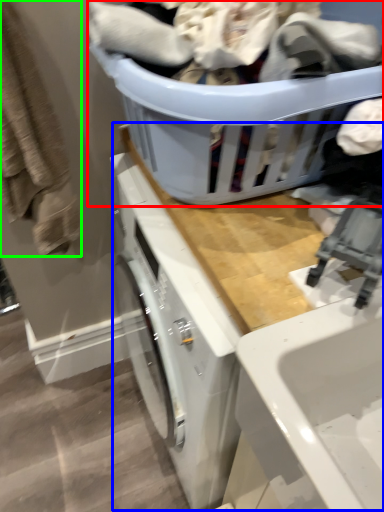
Question: Which is farther away from basket (highlighted by a red box)? counter top (highlighted by a blue box) or clothing (highlighted by a green box)?

Choices:
 (A) counter top
 (B) clothing

Answer: (B)